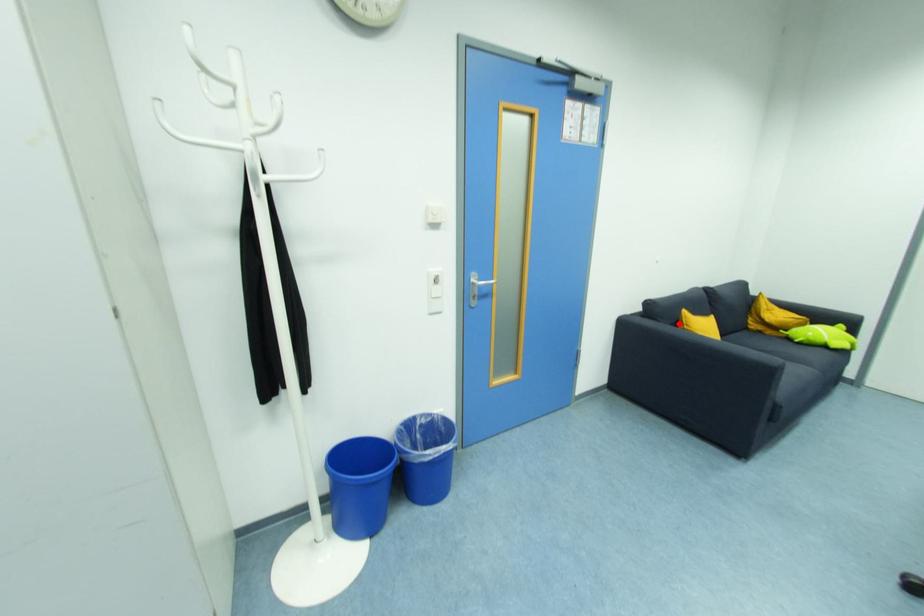
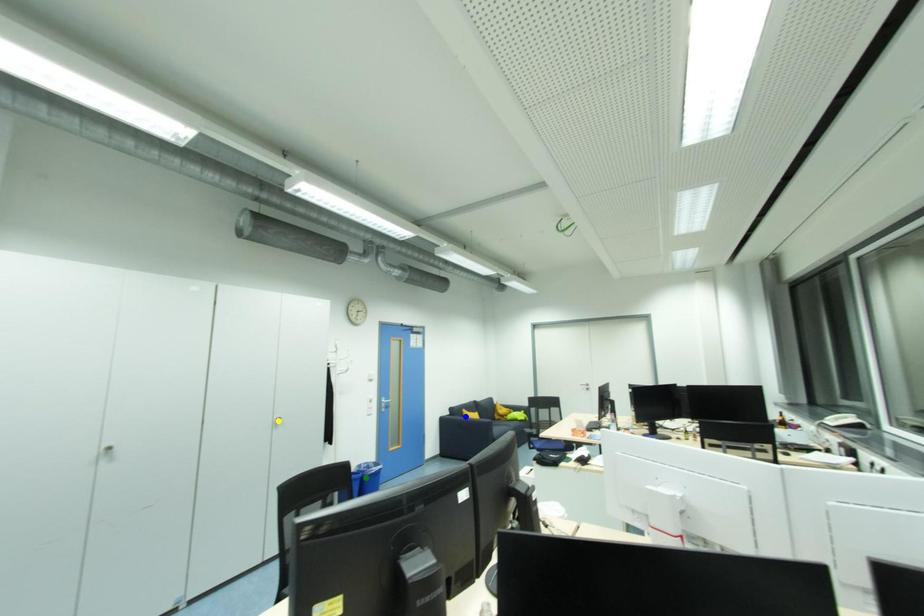
Question: I am providing you with two images of the same scene from different viewpoints. A red point is marked on the first image. You are given multiple points on the second image. Which mark in image 2 goes with the point in image 1?

Choices:
 (A) blue point
 (B) green point
 (C) yellow point

Answer: (A)